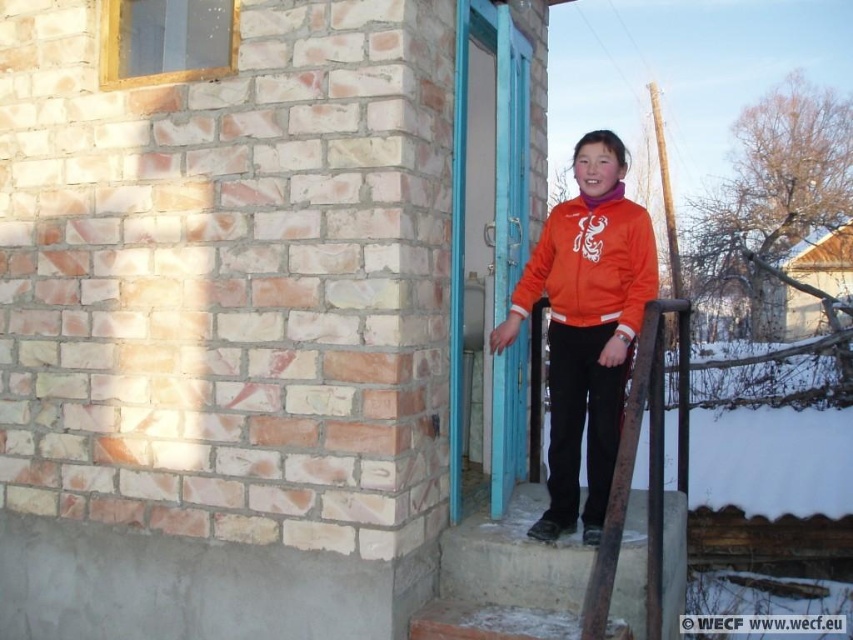
You are a delivery person trying to locate the entrance of the brick building. The entrance is marked by two points in the image. The first point is at coordinate point (595, 202) and the second is at point (548, 260). Which point is closer to the entrance?

Point (595, 202) is in front of point (548, 260), so the first point is closer to the entrance.

You are trying to determine if the orange fleece jacket at center and the orange fleece sweatshirt at center are the same item. Based on the provided information, are they the same item?

The orange fleece jacket at center and the orange fleece sweatshirt at center are not the same item because there is a distance of 4.06 inches between them.